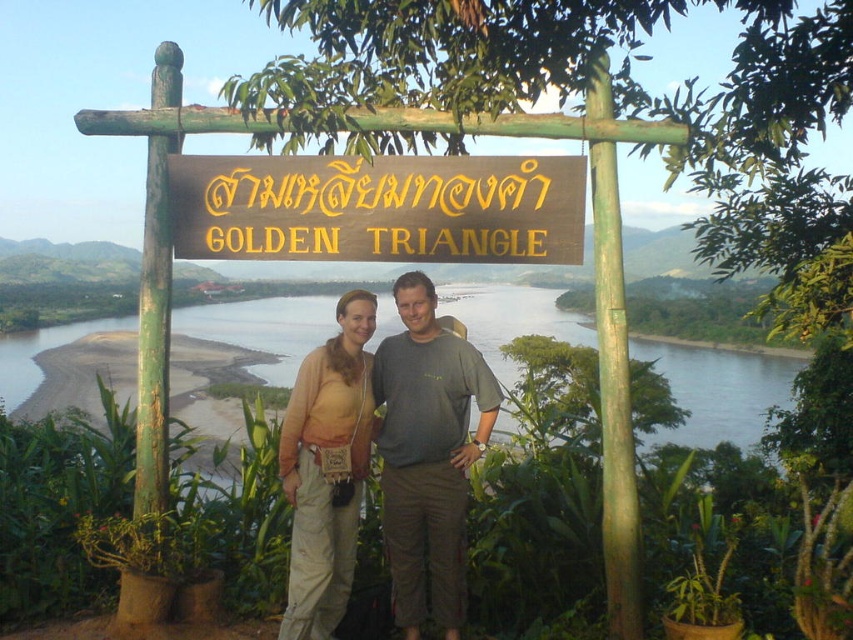
Does green water at center have a greater width compared to beige cotton pants at center?

Incorrect, green water at center's width does not surpass beige cotton pants at center's.

How distant is green water at center from beige cotton pants at center?

green water at center is 5.60 meters from beige cotton pants at center.

Which is in front, point (738, 400) or point (373, 317)?

Point (373, 317) is more forward.

You are a GUI agent. You are given a task and a screenshot of the screen. Output one action in this format:
    pyautogui.click(x=<x>, y=<y>)
    Task: Click on the green water at center
    This screenshot has width=853, height=640.
    Given the screenshot: What is the action you would take?
    pos(718,390)

Can you confirm if gold/yellow wood sign at center is positioned below green water at center?

No, gold/yellow wood sign at center is not below green water at center.

Which is behind, point (299, 157) or point (38, 385)?

Positioned behind is point (38, 385).

You are a GUI agent. You are given a task and a screenshot of the screen. Output one action in this format:
    pyautogui.click(x=<x>, y=<y>)
    Task: Click on the gold/yellow wood sign at center
    The width and height of the screenshot is (853, 640).
    Given the screenshot: What is the action you would take?
    pyautogui.click(x=378, y=209)

Does point (436, 380) come behind point (335, 369)?

Yes, it is.

In the scene shown: Is gray cotton t-shirt at center thinner than beige cotton pants at center?

No, gray cotton t-shirt at center is not thinner than beige cotton pants at center.

Between point (413, 380) and point (305, 358), which one is positioned behind?

The point (413, 380) is behind.

Locate an element on the screen. gray cotton t-shirt at center is located at coordinates (427, 452).